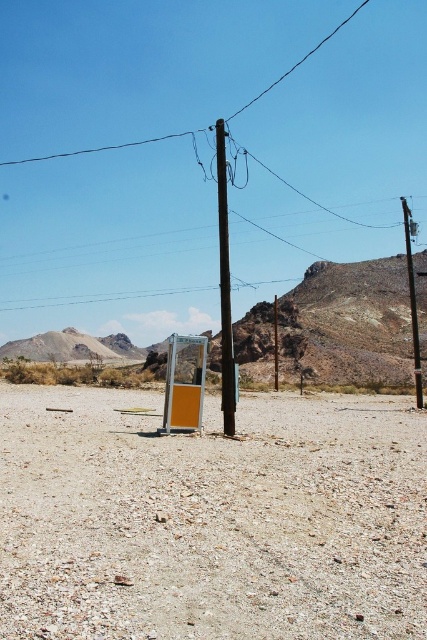
Question: Does gray gravelly dirt at center lie behind yellow matte sign at center?

Choices:
 (A) yes
 (B) no

Answer: (B)

Question: Which point is farther to the camera?

Choices:
 (A) smooth brown wooden telegraph pole at center
 (B) black wire at upper center
 (C) smooth wood telegraph pole at right
 (D) yellow matte sign at center

Answer: (B)

Question: Does black wire at upper center appear on the right side of smooth wood telegraph pole at right?

Choices:
 (A) no
 (B) yes

Answer: (A)

Question: Which is nearer to the yellow matte sign at center?

Choices:
 (A) gray gravelly dirt at center
 (B) smooth brown wooden telegraph pole at center
 (C) smooth wood telegraph pole at right

Answer: (A)

Question: Can you confirm if smooth brown wooden telegraph pole at center is positioned to the left of yellow matte sign at center?

Choices:
 (A) yes
 (B) no

Answer: (B)

Question: Which point is closer to the camera taking this photo?

Choices:
 (A) (219, 204)
 (B) (408, 269)
 (C) (163, 413)

Answer: (C)